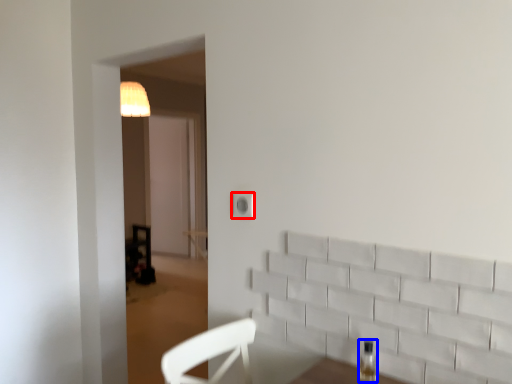
Question: Which object is further to the camera taking this photo, electric outlet (highlighted by a red box) or bottle (highlighted by a blue box)?

Choices:
 (A) electric outlet
 (B) bottle

Answer: (A)